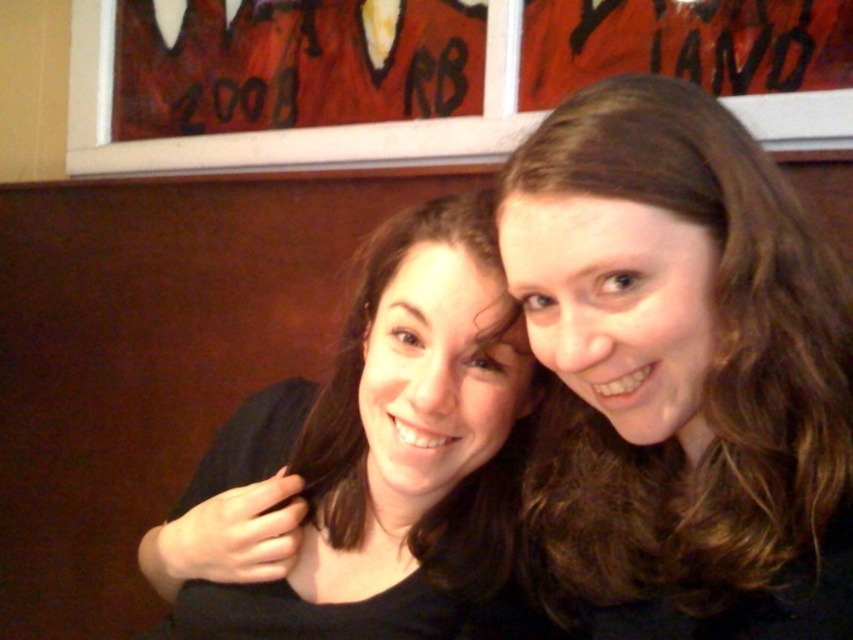
You are a photographer adjusting the camera focus. The two subjects have brown hair at upper right and black matte hair at center. Since the camera can only focus on one subject at a time, which subject should you focus on to ensure the other is still in focus given the depth of field allows for 6 inches of sharpness?

The camera can focus on either brown hair at upper right or black matte hair at center since the distance between them is 6.01 inches, which is just beyond the 6 inches of sharpness. However, focusing on the midpoint between them would place both within the depth of field. Since the question specifies focusing on one subject, choosing the closer one to the midpoint would be optimal, but the exact answer depends on camera settings. However, based on the given data, focusing on either may not fully capture 6.

Based on the scene described, what is located at the coordinates point [680,372]?

The point [680,372] is where the brown hair at upper right is located.